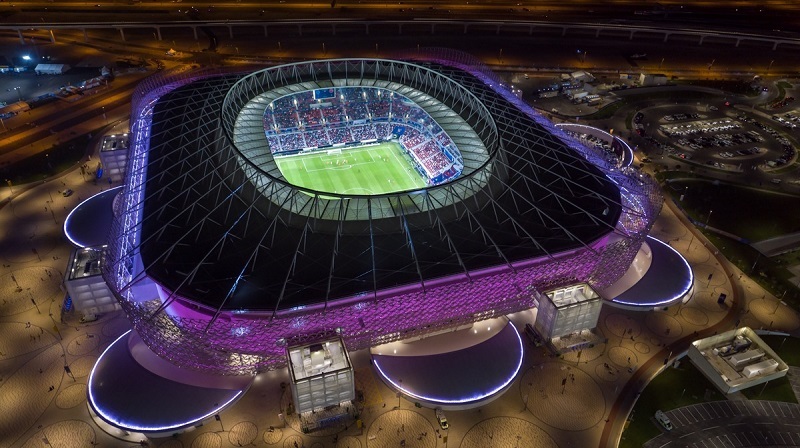
You are a GUI agent. You are given a task and a screenshot of the screen. Output one action in this format:
    pyautogui.click(x=<x>, y=<y>)
    Task: Click on the cover
    This screenshot has height=448, width=800.
    Given the screenshot: What is the action you would take?
    pyautogui.click(x=608, y=140)